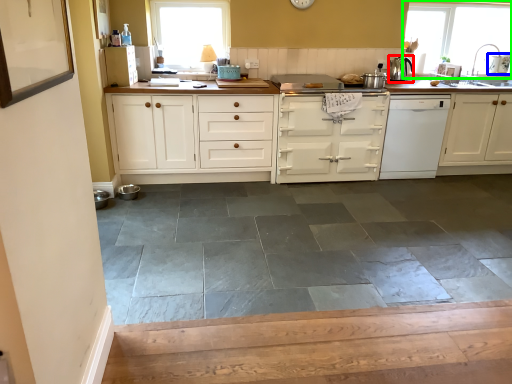
Question: Based on their relative distances, which object is nearer to kitchen appliance (highlighted by a red box)? Choose from appliance (highlighted by a blue box) and window (highlighted by a green box).

Choices:
 (A) appliance
 (B) window

Answer: (B)